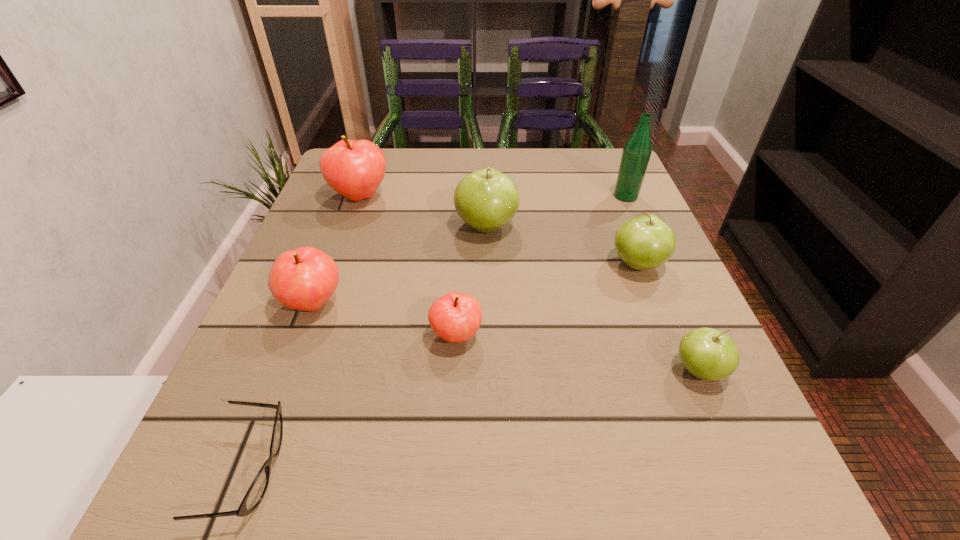
At what (x,y) coordinates should I click in order to perform the action: click on apple that is at the far edge. Please return your answer as a coordinate pair (x, y). Looking at the image, I should click on (355, 169).

What are the coordinates of `object located at the near edge` in the screenshot? It's located at (253, 497).

The width and height of the screenshot is (960, 540). What are the coordinates of `spectacles that is at the left edge` in the screenshot? It's located at (253, 497).

Identify the location of bottle at the right edge. (637, 151).

Identify the location of object present at the far left corner. The height and width of the screenshot is (540, 960). (355, 169).

Locate an element on the screen. object that is at the near left corner is located at coordinates (253, 497).

Where is `object present at the far right corner`? The height and width of the screenshot is (540, 960). object present at the far right corner is located at coordinates (637, 151).

At what (x,y) coordinates should I click in order to perform the action: click on vacant space at the far edge of the desktop. Please return your answer as a coordinate pair (x, y). Looking at the image, I should click on (396, 193).

In the image, there is a desktop. Where is `vacant space at the left edge`? This screenshot has height=540, width=960. vacant space at the left edge is located at coordinates coord(356,249).

Identify the location of free space at the right edge of the desktop. Image resolution: width=960 pixels, height=540 pixels. (641, 401).